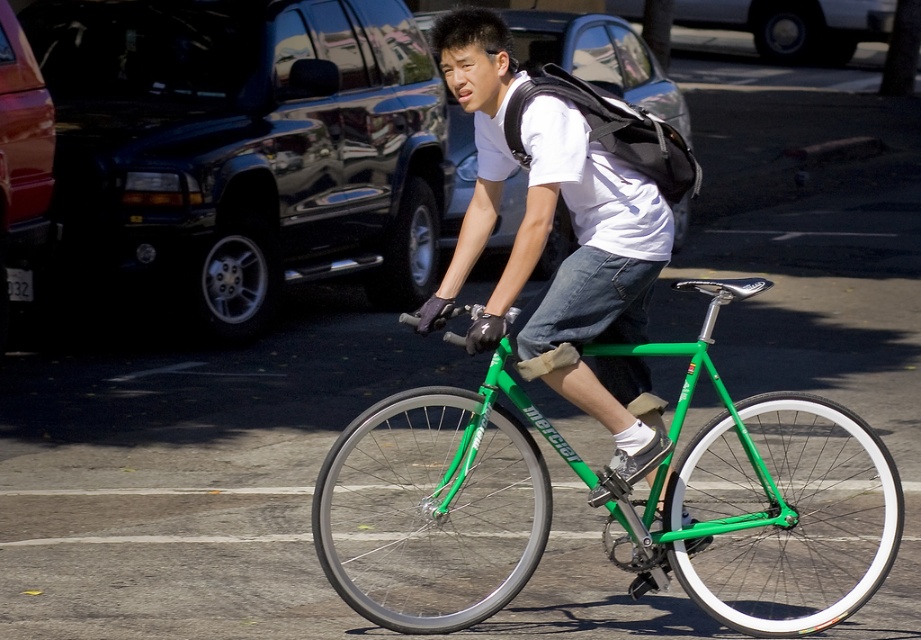
Question: Which point is farther from the camera taking this photo?

Choices:
 (A) (418, 211)
 (B) (589, 177)

Answer: (A)

Question: Which object is closer to the camera taking this photo?

Choices:
 (A) matte green bicycle at center
 (B) black fabric backpack at upper center

Answer: (A)

Question: Is shiny black suv at upper left behind green matte bicycle at center?

Choices:
 (A) no
 (B) yes

Answer: (B)

Question: Observing the image, what is the correct spatial positioning of green matte bicycle at center in reference to matte green bicycle at center?

Choices:
 (A) left
 (B) right

Answer: (B)

Question: Considering the real-world distances, which object is farthest from the matte green bicycle at center?

Choices:
 (A) black fabric backpack at upper center
 (B) shiny black suv at upper left

Answer: (B)

Question: Is green matte bicycle at center further to the viewer compared to black fabric backpack at upper center?

Choices:
 (A) yes
 (B) no

Answer: (B)